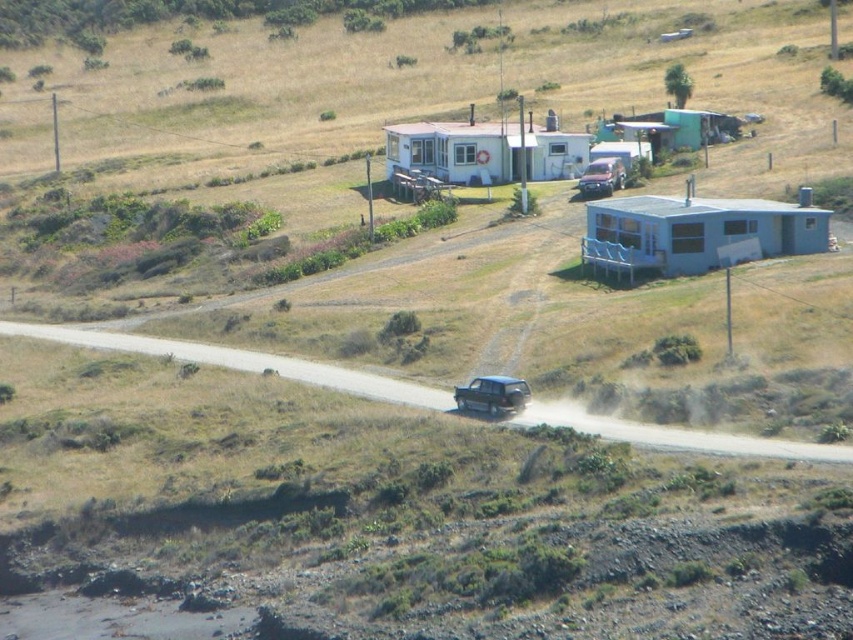
Who is more forward, (503, 378) or (616, 172)?

Positioned in front is point (503, 378).

At what (x,y) coordinates should I click in order to perform the action: click on metallic silver suv at center. Please return your answer as a coordinate pair (x, y). Looking at the image, I should click on (492, 396).

Between point (198, 353) and point (595, 172), which one is positioned behind?

Point (595, 172)

Does brown dirt track at center lie behind satin black suv at center?

That is False.

Find the location of `brown dirt track at center`. brown dirt track at center is located at coordinates (241, 362).

The height and width of the screenshot is (640, 853). I want to click on brown dirt track at center, so click(x=241, y=362).

Between brown dirt track at center and metallic silver suv at center, which one is positioned lower?

metallic silver suv at center is lower down.

Between point (421, 392) and point (508, 403), which one is positioned in front?

Positioned in front is point (508, 403).

Find the location of a particular element. This screenshot has width=853, height=640. brown dirt track at center is located at coordinates click(x=241, y=362).